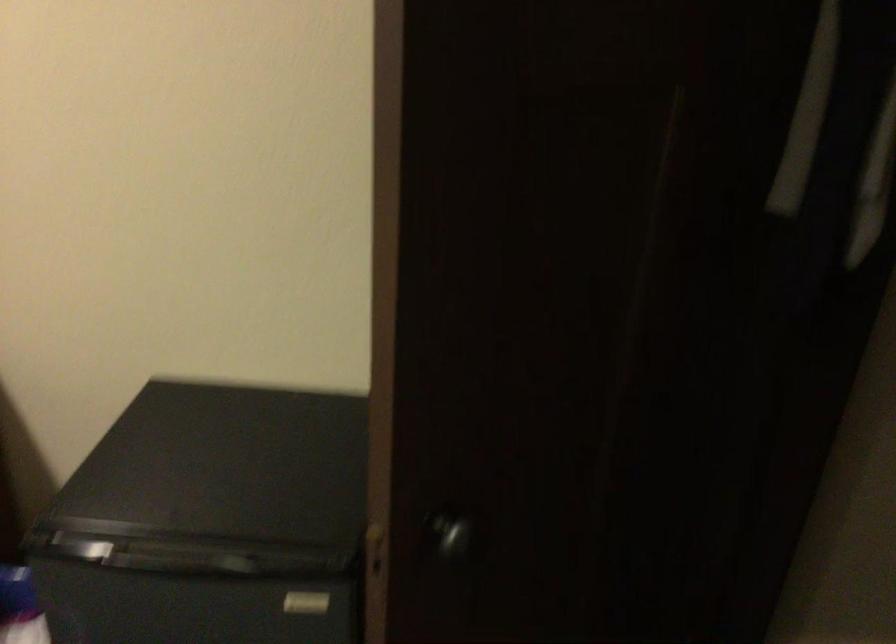
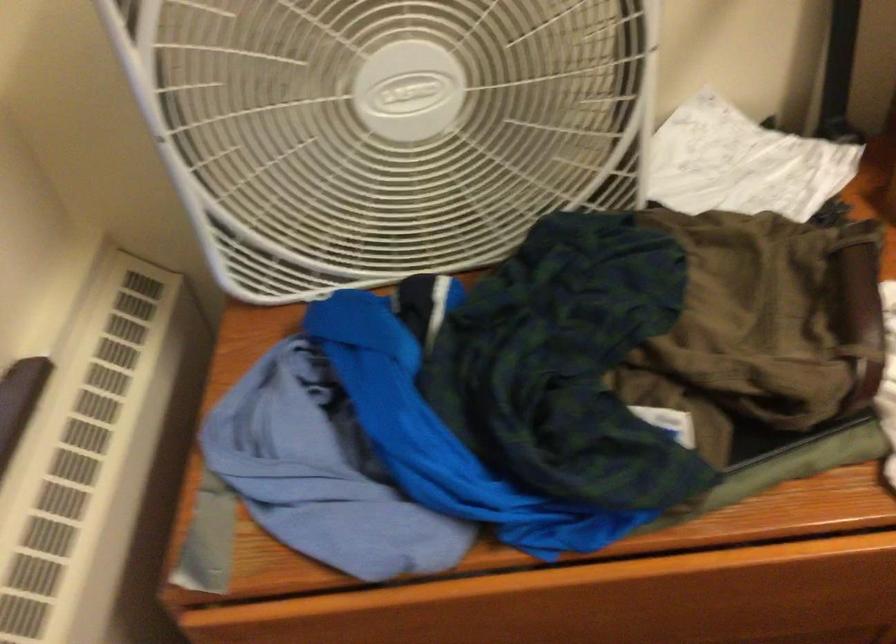
Question: In a continuous first-person perspective shot, in which direction is the camera moving?

Choices:
 (A) Left
 (B) Right
 (C) Forward
 (D) Backward

Answer: (A)